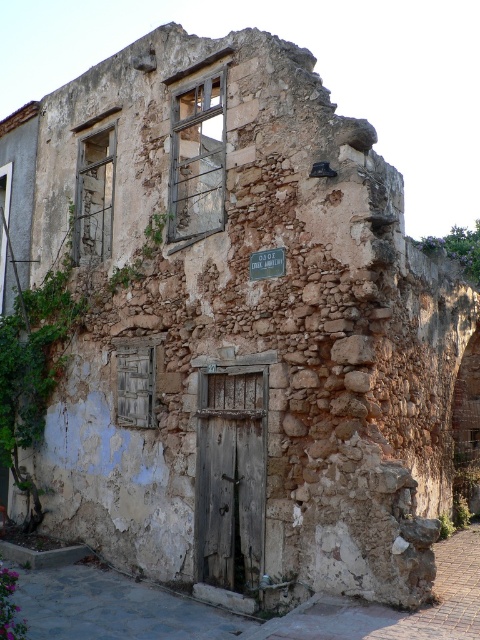
Question: Which of the following is the farthest from the observer?

Choices:
 (A) (219, 404)
 (B) (264, 268)

Answer: (A)

Question: Which of the following is the farthest from the observer?

Choices:
 (A) [x=254, y=406]
 (B) [x=254, y=259]

Answer: (B)

Question: Which of the following is the closest to the observer?

Choices:
 (A) [x=264, y=250]
 (B) [x=240, y=436]

Answer: (B)

Question: Is wooden textured door at center closer to the viewer compared to metallic rectangular sign at center?

Choices:
 (A) yes
 (B) no

Answer: (B)

Question: Does wooden textured door at center appear on the right side of metallic rectangular sign at center?

Choices:
 (A) yes
 (B) no

Answer: (B)

Question: Does wooden textured door at center have a lesser width compared to metallic rectangular sign at center?

Choices:
 (A) no
 (B) yes

Answer: (B)